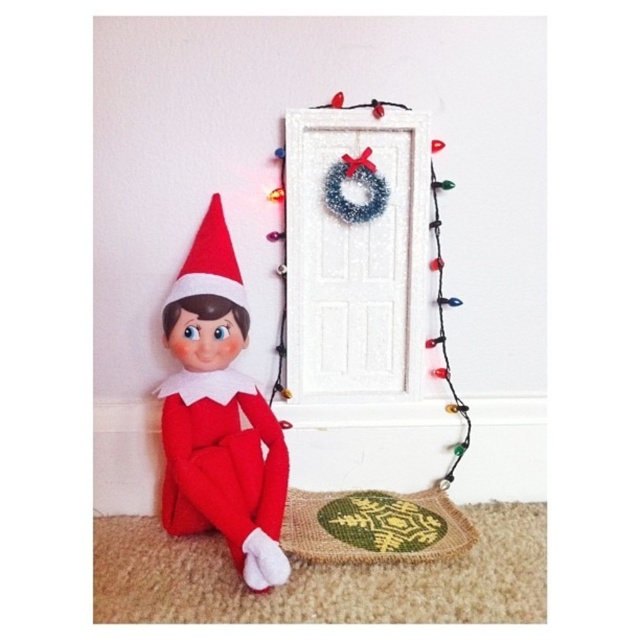
Consider the image. You are a photographer holding a camera at the bottom left of the image. You want to take a photo of the multicolored string lights at upper center. Can you reach the camera to the lights without moving the camera? Explain why or why not.

The multicolored string lights at upper center and camera are 1.21 meters apart from each other. Since the camera is at the bottom left and the lights are at upper center, you cannot reach the camera to the lights without moving it because they are too far apart.

You are a guest at a holiday party and see the multicolored string lights at upper center and the green woven mat at lower center. Which object is larger in size?

The multicolored string lights at upper center is bigger than the green woven mat at lower center.

You are an elf in the image and want to hang a new wreath on the door to the right. To do this, you need to know the exact location of the multicolored string lights at upper center. What are their coordinates?

The coordinates of the multicolored string lights at upper center are at point (342, 253).